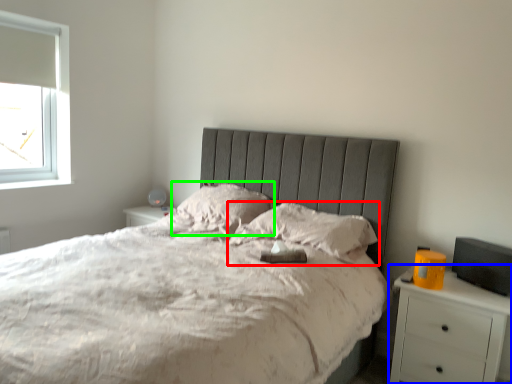
Question: Based on their relative distances, which object is farther from pillow (highlighted by a red box)? Choose from nightstand (highlighted by a blue box) and pillow (highlighted by a green box).

Choices:
 (A) nightstand
 (B) pillow

Answer: (A)